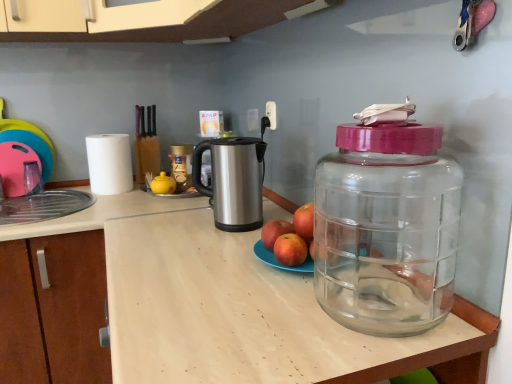
Question: From a real-world perspective, is transparent plastic bottle at right, which ranks as the 2th bottle in left-to-right order, above or below white matte paper towel at left?

Choices:
 (A) below
 (B) above

Answer: (B)

Question: Is transparent plastic bottle at right, which ranks as the 2th bottle in left-to-right order, wider or thinner than white matte paper towel at left?

Choices:
 (A) wide
 (B) thin

Answer: (A)

Question: Estimate the real-world distances between objects in this image. Which object is farther from the silver metallic kettle at center?

Choices:
 (A) white matte paper towel at left
 (B) red matte apple at center, positioned as the second apple in right-to-left order
 (C) transparent plastic bottle at right, arranged as the 1th bottle when viewed from the front
 (D) transparent wood counter top at center, positioned as the second counter top in back-to-front order
 (E) red matte apple at center, the first apple positioned from the left

Answer: (A)

Question: Estimate the real-world distances between objects in this image. Which object is farther from the silver metallic kettle at center?

Choices:
 (A) metallic gold jar at center, the 1th bottle from the back
 (B) red matte apple at center, the 1th apple positioned from the right
 (C) transparent wood counter top at center, positioned as the second counter top in back-to-front order
 (D) pink rubber toy at left
 (E) light wood at center, the second counter top positioned from the front

Answer: (D)